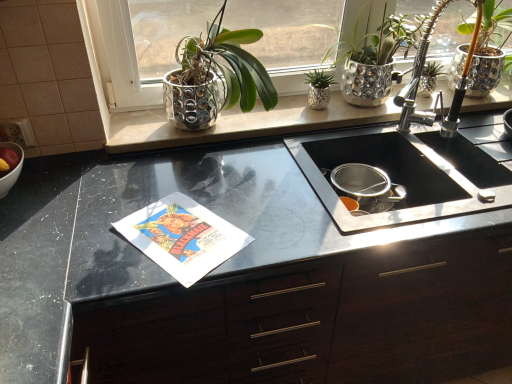
Question: Should I look upward or downward to see green metallic pot at upper center, which is counted as the second houseplant, starting from the left?

Choices:
 (A) up
 (B) down

Answer: (A)

Question: From a real-world perspective, is satin nickel faucet at upper right on top of shiny metallic pot at upper center, which is the 3th houseplant in right-to-left order?

Choices:
 (A) no
 (B) yes

Answer: (A)

Question: Is shiny metallic pot at upper center, positioned as the 1th houseplant in left-to-right order, located within satin nickel faucet at upper right?

Choices:
 (A) no
 (B) yes

Answer: (A)

Question: From the image's perspective, is satin nickel faucet at upper right under shiny metallic pot at upper center, positioned as the 1th houseplant in left-to-right order?

Choices:
 (A) no
 (B) yes

Answer: (B)

Question: Is satin nickel faucet at upper right outside shiny metallic pot at upper center, positioned as the 1th houseplant in left-to-right order?

Choices:
 (A) no
 (B) yes

Answer: (B)

Question: Considering the relative positions of satin nickel faucet at upper right and shiny metallic pot at upper center, which is the 3th houseplant in right-to-left order, in the image provided, is satin nickel faucet at upper right to the right of shiny metallic pot at upper center, which is the 3th houseplant in right-to-left order, from the viewer's perspective?

Choices:
 (A) yes
 (B) no

Answer: (A)

Question: Is satin nickel faucet at upper right thinner than shiny metallic pot at upper center, which is the 3th houseplant in right-to-left order?

Choices:
 (A) yes
 (B) no

Answer: (B)

Question: Does shiny metallic pot at upper right, which ranks as the 3th houseplant in left-to-right order, come in front of white glossy bowl at left?

Choices:
 (A) yes
 (B) no

Answer: (B)

Question: Does shiny metallic pot at upper right, which ranks as the 3th houseplant in left-to-right order, turn towards white glossy bowl at left?

Choices:
 (A) no
 (B) yes

Answer: (A)

Question: From the image's perspective, is shiny metallic pot at upper right, which is the first houseplant in right-to-left order, above white glossy bowl at left?

Choices:
 (A) yes
 (B) no

Answer: (A)

Question: Is shiny metallic pot at upper right, which is the first houseplant in right-to-left order, not near white glossy bowl at left?

Choices:
 (A) no
 (B) yes

Answer: (B)

Question: Can you confirm if shiny metallic pot at upper right, which is the first houseplant in right-to-left order, is taller than white glossy bowl at left?

Choices:
 (A) no
 (B) yes

Answer: (B)

Question: Is shiny metallic pot at upper right, which ranks as the 3th houseplant in left-to-right order, placed right next to white glossy bowl at left?

Choices:
 (A) yes
 (B) no

Answer: (B)

Question: Does satin nickel faucet at upper right turn towards black matte cabinet at center?

Choices:
 (A) no
 (B) yes

Answer: (A)